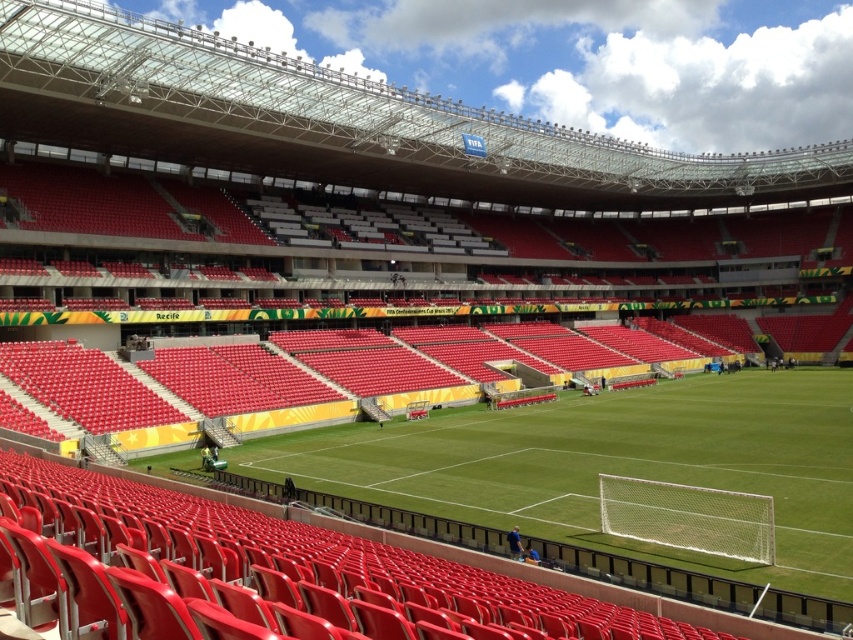
Question: Does green grass football field at center lie in front of metallic silver cart at center?

Choices:
 (A) yes
 (B) no

Answer: (A)

Question: Which of the following is the closest to the observer?

Choices:
 (A) (407, 419)
 (B) (664, 504)

Answer: (B)

Question: Among these objects, which one is nearest to the camera?

Choices:
 (A) metallic silver cart at center
 (B) white mesh net at lower right
 (C) green grass football field at center

Answer: (C)

Question: Is green grass football field at center below white mesh net at lower right?

Choices:
 (A) yes
 (B) no

Answer: (A)

Question: Which point is farther to the camera?

Choices:
 (A) (518, 465)
 (B) (767, 532)

Answer: (A)

Question: Is white mesh net at lower right below metallic silver cart at center?

Choices:
 (A) no
 (B) yes

Answer: (A)